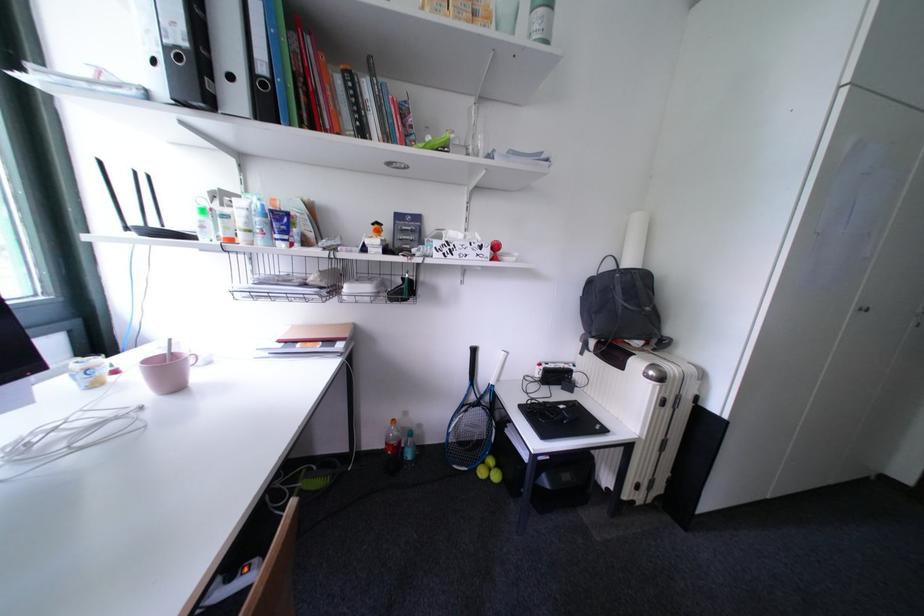
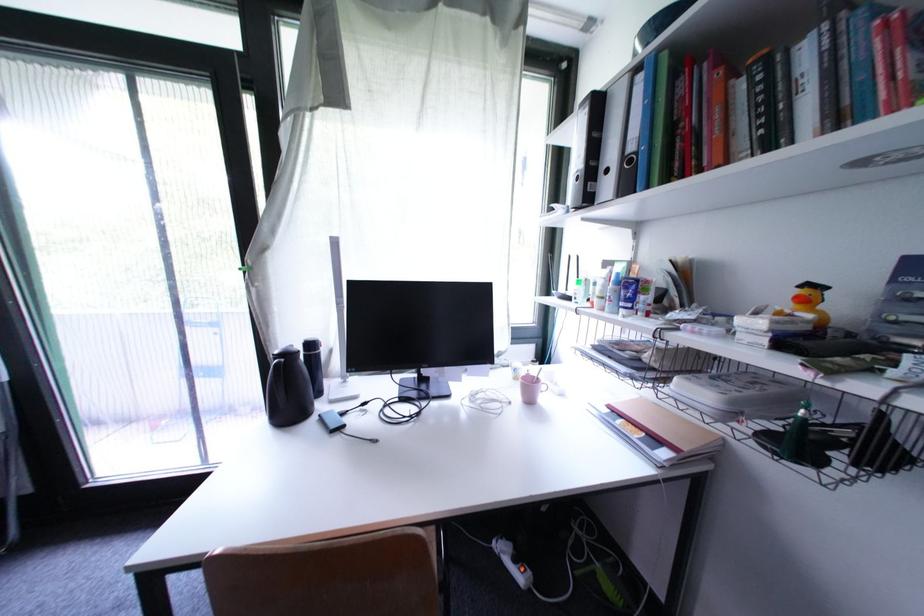
Question: The images are taken continuously from a first-person perspective. In which direction is your viewpoint rotating?

Choices:
 (A) Left
 (B) Right
 (C) Up
 (D) Down

Answer: (A)